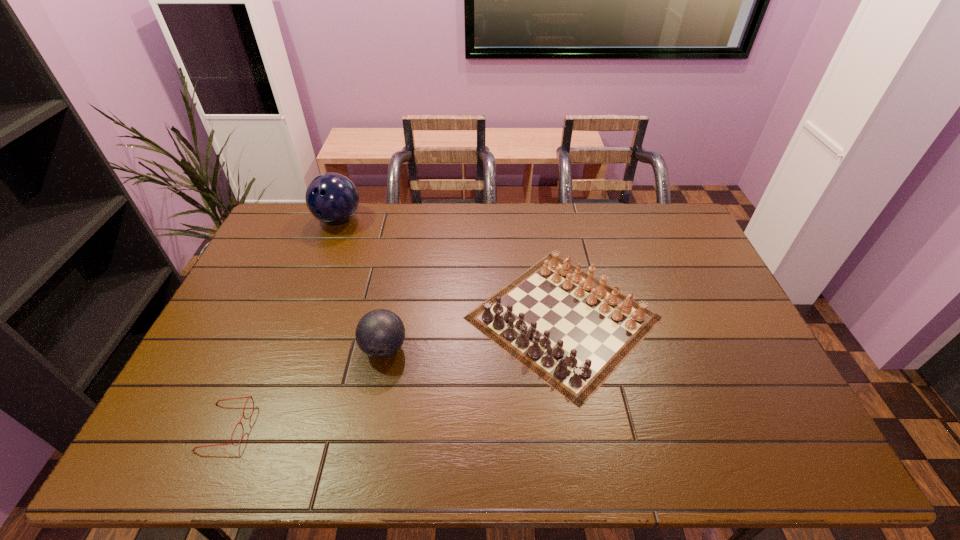
This screenshot has height=540, width=960. I want to click on the farther bowling ball, so click(332, 198).

Image resolution: width=960 pixels, height=540 pixels. I want to click on the farthest object, so click(x=332, y=198).

You are a GUI agent. You are given a task and a screenshot of the screen. Output one action in this format:
    pyautogui.click(x=<x>, y=<y>)
    Task: Click on the shorter bowling ball
    
    Given the screenshot: What is the action you would take?
    pyautogui.click(x=380, y=333)

Identify the location of the right bowling ball. The width and height of the screenshot is (960, 540). (380, 333).

The height and width of the screenshot is (540, 960). I want to click on the rightmost object, so click(573, 334).

Image resolution: width=960 pixels, height=540 pixels. I want to click on the second shortest object, so (x=573, y=334).

In order to click on spectacles in this screenshot , I will do `click(248, 397)`.

At what (x,y) coordinates should I click in order to perform the action: click on free point located on the surface of the farther bowling ball near the finger holes. Please return your answer as a coordinate pair (x, y). Looking at the image, I should click on (309, 296).

Locate an element on the screen. This screenshot has height=540, width=960. vacant area located 0.260m on the grip area of the right bowling ball is located at coordinates (362, 464).

This screenshot has width=960, height=540. I want to click on free location located 0.120m on the front of the third tallest object, so click(x=588, y=456).